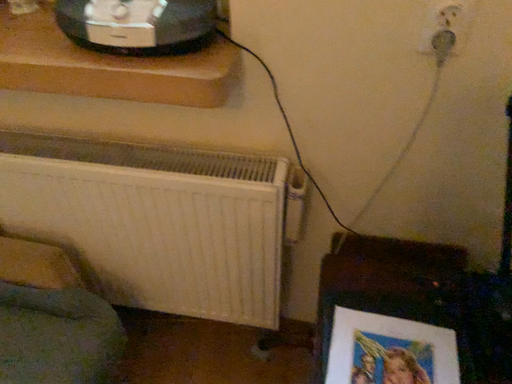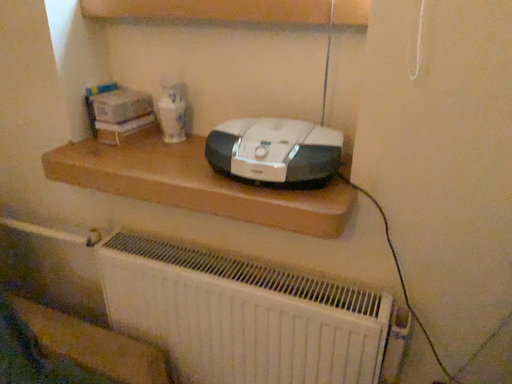
Question: Which way did the camera rotate in the video?

Choices:
 (A) rotated upward
 (B) rotated downward

Answer: (A)